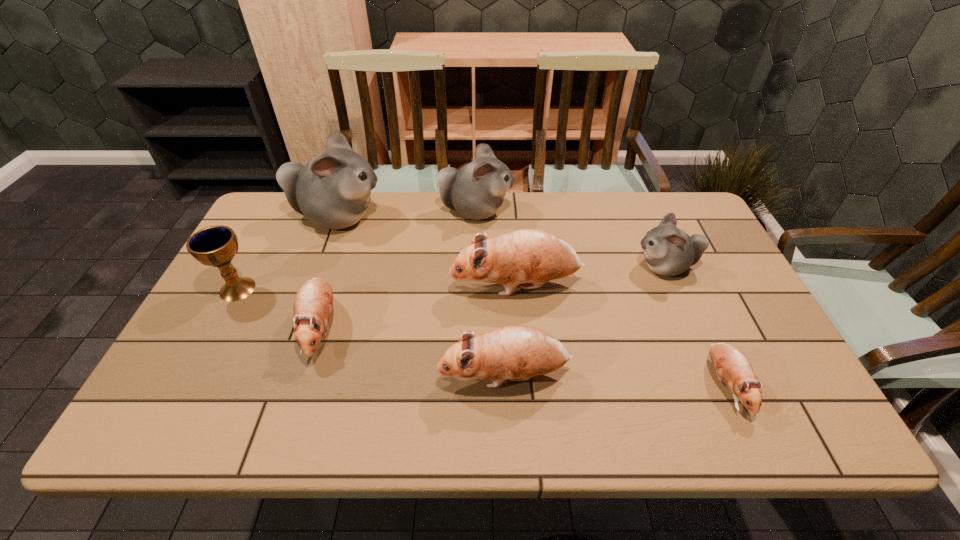
Find the location of a particular element. The image size is (960, 540). free space that satisfies the following two spatial constraints: 1. on the face of the rightmost white hamster; 2. at the face of the third biggest brown hamster is located at coordinates (691, 328).